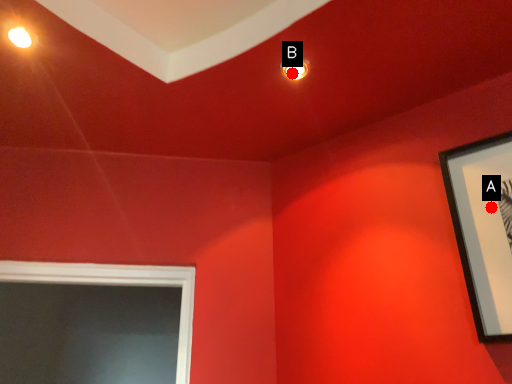
Question: Two points are circled on the image, labeled by A and B beside each circle. Which of the following is the closest to the observer?

Choices:
 (A) A is closer
 (B) B is closer

Answer: (A)